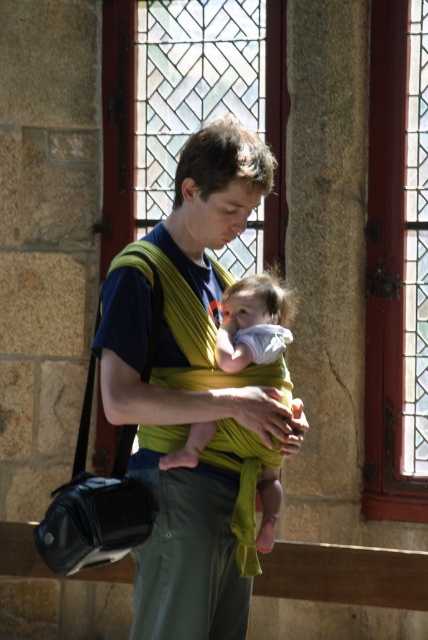
Question: Which object is closer to the camera taking this photo?

Choices:
 (A) green fabric baby carrier at center
 (B) soft white cloth at center

Answer: (A)

Question: Which of the following is the closest to the observer?

Choices:
 (A) pos(250,205)
 (B) pos(184,461)

Answer: (B)

Question: Can you confirm if green fabric baby carrier at center is positioned below soft white cloth at center?

Choices:
 (A) yes
 (B) no

Answer: (A)

Question: In this image, where is green fabric baby carrier at center located relative to soft white cloth at center?

Choices:
 (A) below
 (B) above

Answer: (A)

Question: Can you confirm if green fabric baby carrier at center is positioned to the right of soft white cloth at center?

Choices:
 (A) no
 (B) yes

Answer: (A)